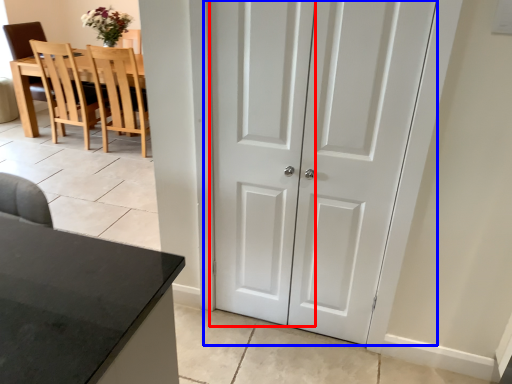
Question: Which object is further to the camera taking this photo, screen door (highlighted by a red box) or door (highlighted by a blue box)?

Choices:
 (A) screen door
 (B) door

Answer: (A)